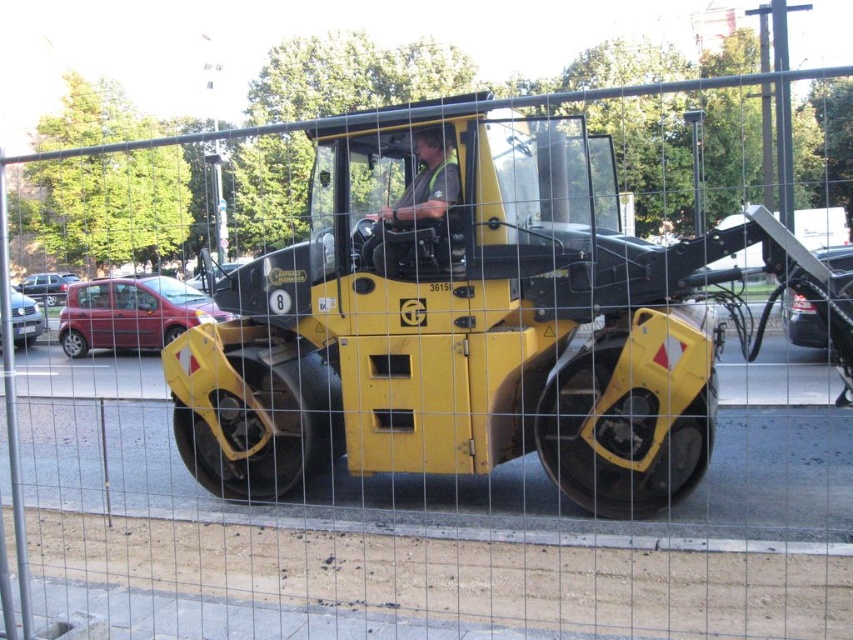
Question: Which point is farther to the camera?

Choices:
 (A) (459, 188)
 (B) (747, 220)

Answer: (A)

Question: Among these points, which one is nearest to the camera?

Choices:
 (A) (387, 262)
 (B) (579, 292)

Answer: (B)

Question: In this image, where is yellow matte compactor at center located relative to green fabric construction worker at center?

Choices:
 (A) above
 (B) below

Answer: (B)

Question: Which point is farther to the camera?

Choices:
 (A) (428, 145)
 (B) (337, 397)

Answer: (B)

Question: Can you confirm if yellow matte compactor at center is smaller than green fabric construction worker at center?

Choices:
 (A) no
 (B) yes

Answer: (A)

Question: Can you confirm if yellow matte compactor at center is thinner than green fabric construction worker at center?

Choices:
 (A) no
 (B) yes

Answer: (A)